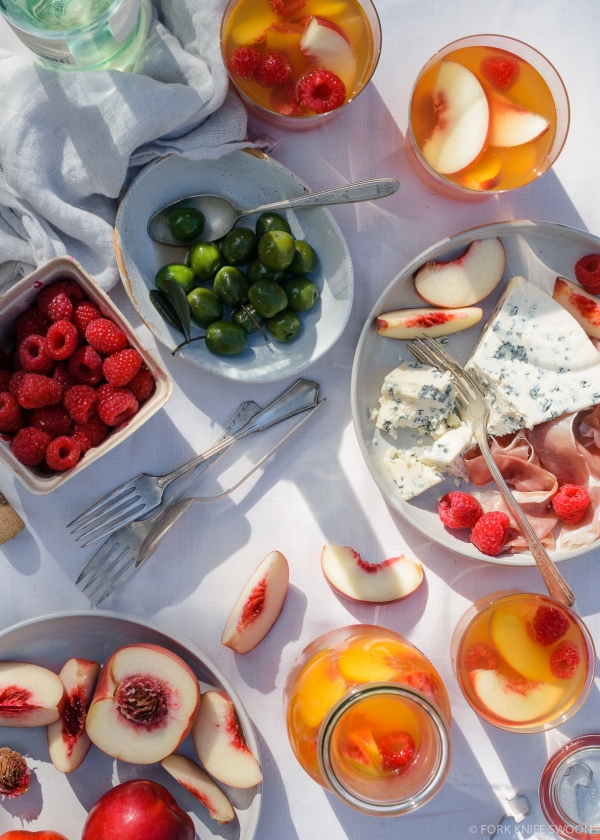
Identify the location of spoon. click(163, 520), click(213, 213).